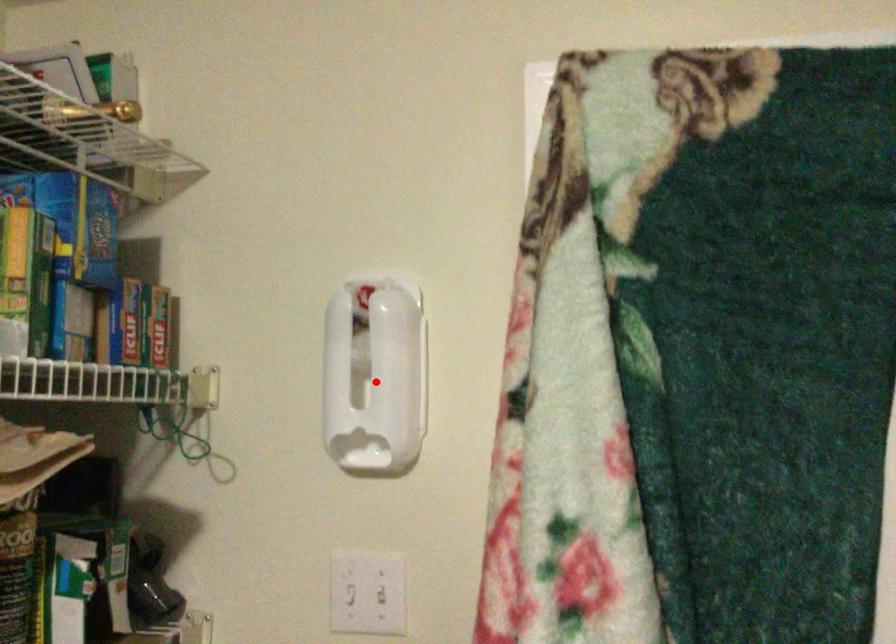
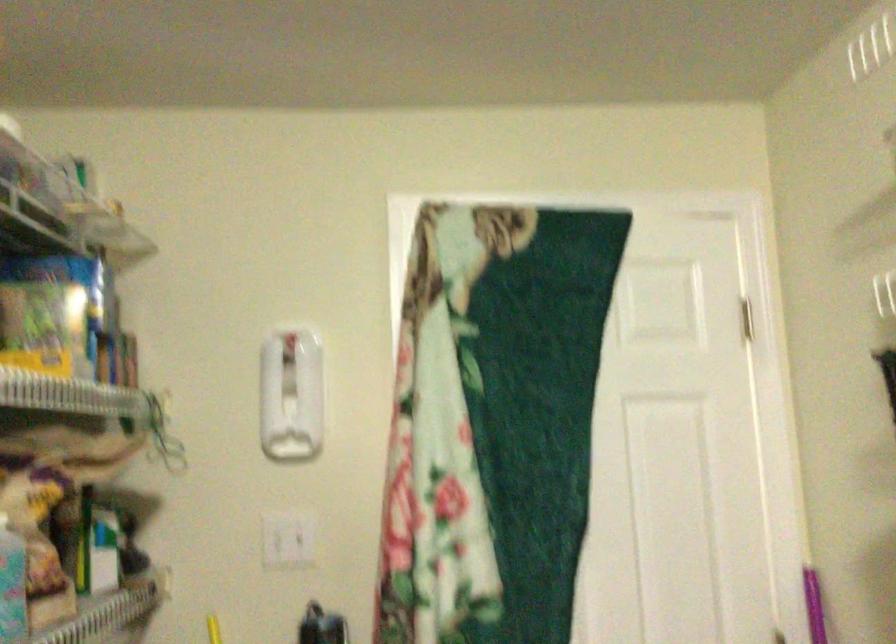
Question: I am providing you with two images of the same scene from different viewpoints. In image1, a red point is highlighted. Considering the same 3D point in image2, which of the following is correct?

Choices:
 (A) It is closer
 (B) It is farther

Answer: (B)